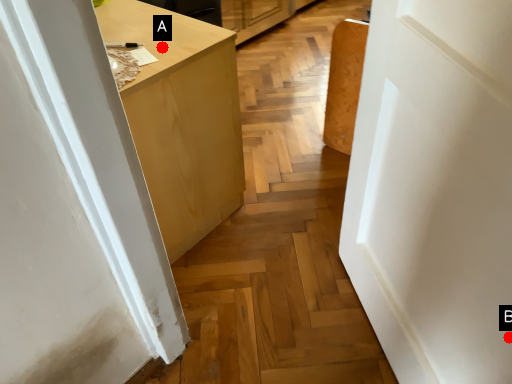
Question: Two points are circled on the image, labeled by A and B beside each circle. Which point is farther from the camera taking this photo?

Choices:
 (A) A is further
 (B) B is further

Answer: (A)